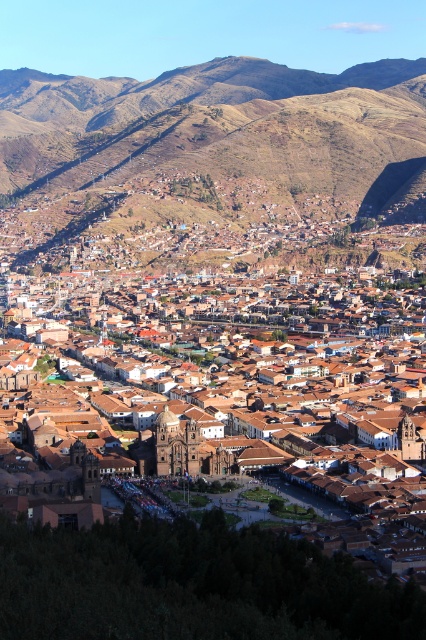
Question: Which object appears farthest from the camera in this image?

Choices:
 (A) brown clay buildings at center
 (B) brown rocky mountain at upper center

Answer: (B)

Question: Is brown rocky mountain at upper center to the left of brown clay buildings at center from the viewer's perspective?

Choices:
 (A) yes
 (B) no

Answer: (B)

Question: Does brown rocky mountain at upper center appear on the left side of brown clay buildings at center?

Choices:
 (A) yes
 (B) no

Answer: (B)

Question: Which of the following is the closest to the observer?

Choices:
 (A) (94, 465)
 (B) (187, 163)

Answer: (A)

Question: Is brown rocky mountain at upper center behind brown clay buildings at center?

Choices:
 (A) no
 (B) yes

Answer: (B)